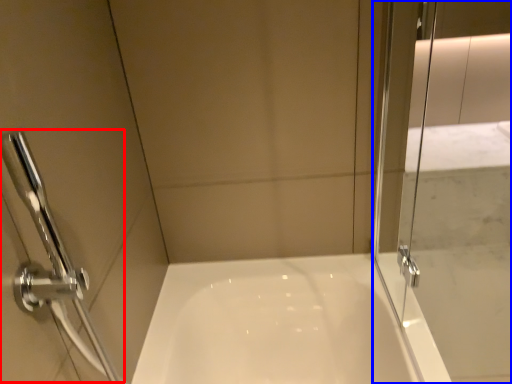
Question: Which point is closer to the camera, shower (highlighted by a red box) or screen door (highlighted by a blue box)?

Choices:
 (A) shower
 (B) screen door

Answer: (B)